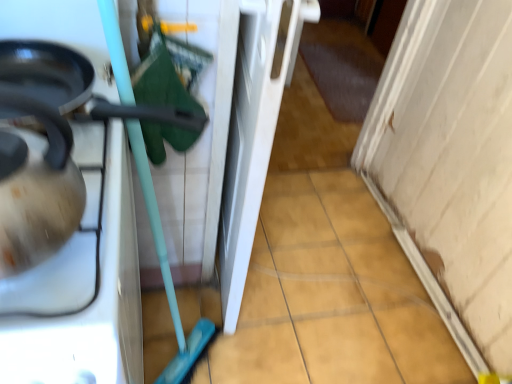
Question: Is shiny black frying pan at left located within matte white tea pot at left?

Choices:
 (A) no
 (B) yes

Answer: (A)

Question: Is matte white tea pot at left at the left side of shiny black frying pan at left?

Choices:
 (A) no
 (B) yes

Answer: (B)

Question: Are matte white tea pot at left and shiny black frying pan at left beside each other?

Choices:
 (A) yes
 (B) no

Answer: (B)

Question: Is matte white tea pot at left not within shiny black frying pan at left?

Choices:
 (A) no
 (B) yes

Answer: (B)

Question: Is matte white tea pot at left oriented away from shiny black frying pan at left?

Choices:
 (A) yes
 (B) no

Answer: (A)

Question: Is matte white tea pot at left not close to shiny black frying pan at left?

Choices:
 (A) no
 (B) yes

Answer: (A)

Question: Is matte black kettle at left taller than matte white tea pot at left?

Choices:
 (A) yes
 (B) no

Answer: (B)

Question: Can you confirm if matte black kettle at left is bigger than matte white tea pot at left?

Choices:
 (A) no
 (B) yes

Answer: (B)

Question: Is matte black kettle at left to the left of matte white tea pot at left from the viewer's perspective?

Choices:
 (A) yes
 (B) no

Answer: (A)

Question: Is matte black kettle at left positioned far away from matte white tea pot at left?

Choices:
 (A) yes
 (B) no

Answer: (B)

Question: Considering the relative sizes of matte black kettle at left and matte white tea pot at left in the image provided, is matte black kettle at left shorter than matte white tea pot at left?

Choices:
 (A) yes
 (B) no

Answer: (A)

Question: Does matte black kettle at left lie behind matte white tea pot at left?

Choices:
 (A) yes
 (B) no

Answer: (A)

Question: Is shiny black frying pan at left shorter than matte white tea pot at left?

Choices:
 (A) yes
 (B) no

Answer: (A)